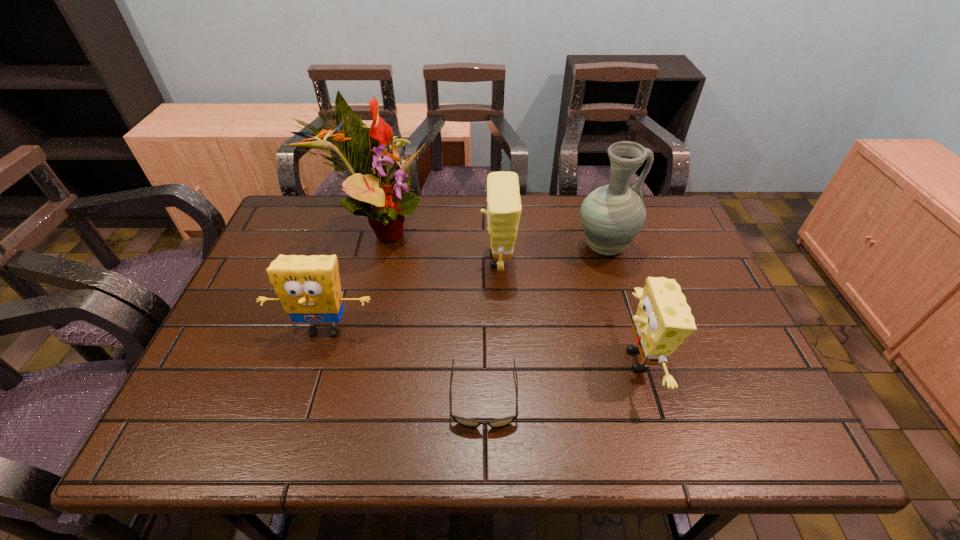
Locate an element on the screen. The image size is (960, 540). free space that satisfies the following two spatial constraints: 1. on the face of the farthest sponge; 2. on the front-facing side of the sunglasses is located at coordinates (504, 397).

Locate an element on the screen. This screenshot has height=540, width=960. vacant area that satisfies the following two spatial constraints: 1. on the face of the farthest sponge; 2. on the face of the leftmost sponge is located at coordinates (501, 330).

The image size is (960, 540). Identify the location of free space that satisfies the following two spatial constraints: 1. on the front-facing side of the tallest object; 2. on the face of the leftmost sponge. (349, 330).